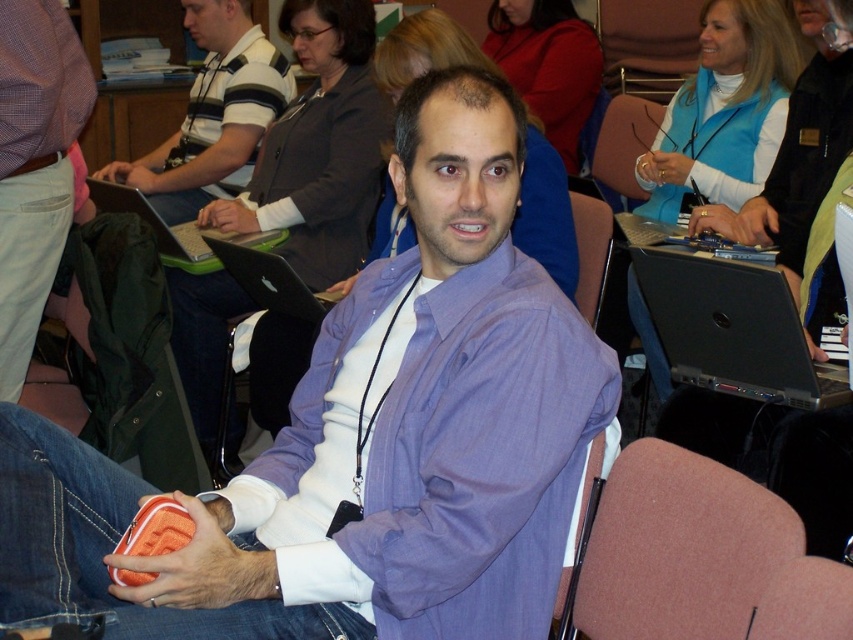
What do you see at coordinates (33, 166) in the screenshot? The image size is (853, 640). I see `brushed metal belt at center` at bounding box center [33, 166].

Does brushed metal belt at center appear on the right side of black plastic laptop at center?

No, brushed metal belt at center is not to the right of black plastic laptop at center.

This screenshot has width=853, height=640. What do you see at coordinates (33, 166) in the screenshot?
I see `brushed metal belt at center` at bounding box center [33, 166].

You are a GUI agent. You are given a task and a screenshot of the screen. Output one action in this format:
    pyautogui.click(x=<x>, y=<y>)
    Task: Click on the brushed metal belt at center
    
    Given the screenshot: What is the action you would take?
    (x=33, y=166)

Is black glossy laptop at center smaller than green plastic laptop at center?

Correct, black glossy laptop at center occupies less space than green plastic laptop at center.

The width and height of the screenshot is (853, 640). In order to click on black glossy laptop at center in this screenshot , I will do `click(265, 276)`.

Which of these two, purple cotton shirt at center or striped cotton shirt at center, stands taller?

With more height is striped cotton shirt at center.

Is point (409, 396) positioned after point (210, 182)?

No, it is in front of (210, 182).

Is point (322, 362) in front of point (199, 92)?

That is True.

Locate an element on the screen. This screenshot has height=640, width=853. purple cotton shirt at center is located at coordinates (476, 458).